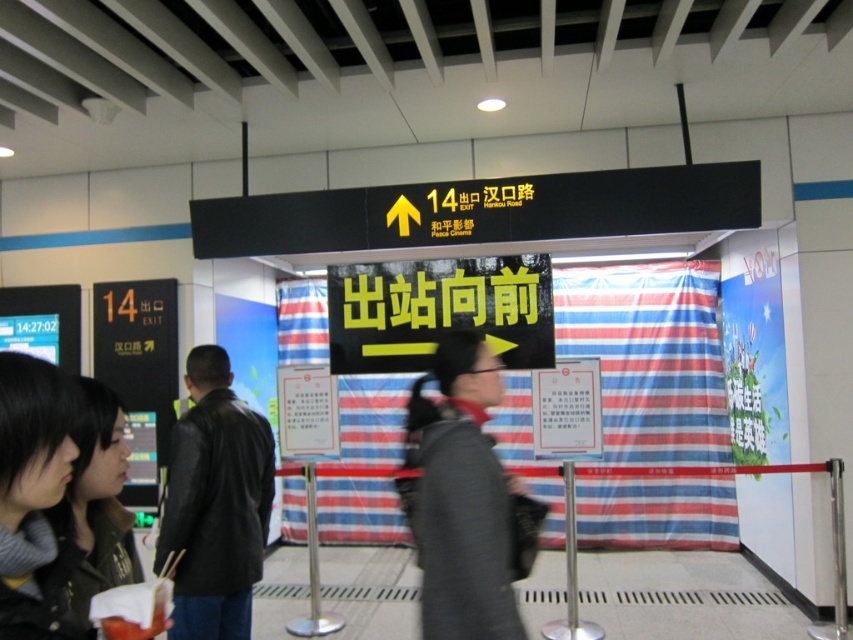
Question: Is the position of dark gray sweater at lower left less distant than that of dark brown leather jacket at lower left?

Choices:
 (A) yes
 (B) no

Answer: (A)

Question: Considering the real-world distances, which object is farthest from the dark brown leather jacket at lower left?

Choices:
 (A) dark gray sweater at lower left
 (B) dark gray jacket at center

Answer: (B)

Question: Does dark gray jacket at center appear over dark brown leather jacket at lower left?

Choices:
 (A) no
 (B) yes

Answer: (A)

Question: Is black leather jacket at left thinner than dark brown leather jacket at lower left?

Choices:
 (A) no
 (B) yes

Answer: (A)

Question: Which of the following is the closest to the observer?

Choices:
 (A) (436, 582)
 (B) (210, 388)
 (C) (105, 490)
 (D) (16, 442)

Answer: (D)

Question: Which point appears closest to the camera in this image?

Choices:
 (A) (30, 362)
 (B) (498, 394)

Answer: (A)